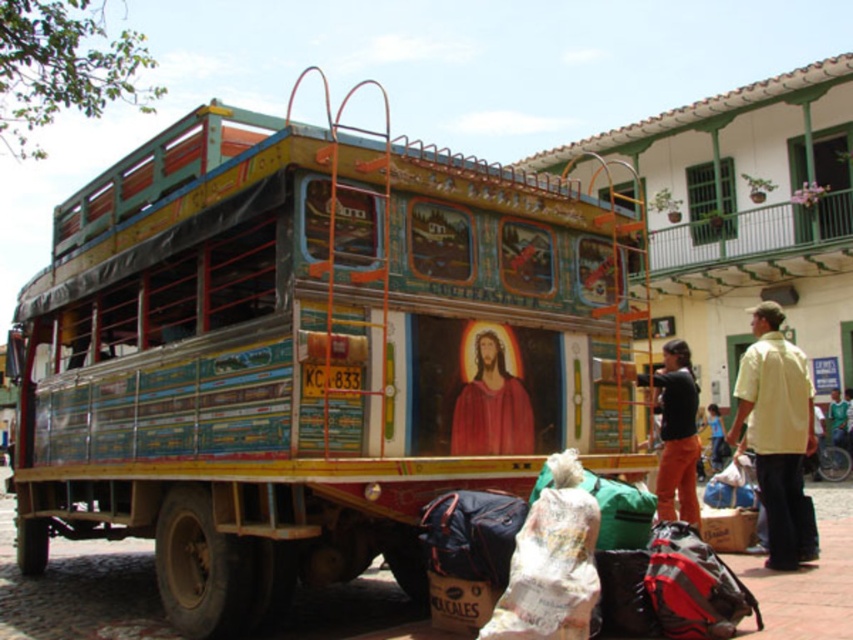
Which of these two, red painted figure at center or orange pants at center, stands taller?

orange pants at center is taller.

Does red painted figure at center have a smaller size compared to orange pants at center?

Yes, red painted figure at center is smaller than orange pants at center.

Consider the image. Who is more distant from viewer, (509, 403) or (677, 481)?

The point (677, 481) is behind.

At what (x,y) coordinates should I click in order to perform the action: click on red painted figure at center. Please return your answer as a coordinate pair (x, y). This screenshot has height=640, width=853. Looking at the image, I should click on (491, 406).

Is yellow cotton shirt at right smaller than orange pants at center?

Incorrect, yellow cotton shirt at right is not smaller in size than orange pants at center.

Is yellow cotton shirt at right thinner than orange pants at center?

Incorrect, yellow cotton shirt at right's width is not less than orange pants at center's.

Between point (776, 380) and point (674, 364), which one is positioned in front?

Point (776, 380)

Locate an element on the screen. This screenshot has width=853, height=640. yellow cotton shirt at right is located at coordinates (776, 433).

Between painted wood food truck at center and red painted figure at center, which one is positioned higher?

painted wood food truck at center is higher up.

Is point (605, 372) more distant than point (526, 445)?

Yes, it is behind point (526, 445).

The height and width of the screenshot is (640, 853). What do you see at coordinates (302, 352) in the screenshot?
I see `painted wood food truck at center` at bounding box center [302, 352].

What are the coordinates of `painted wood food truck at center` in the screenshot? It's located at (302, 352).